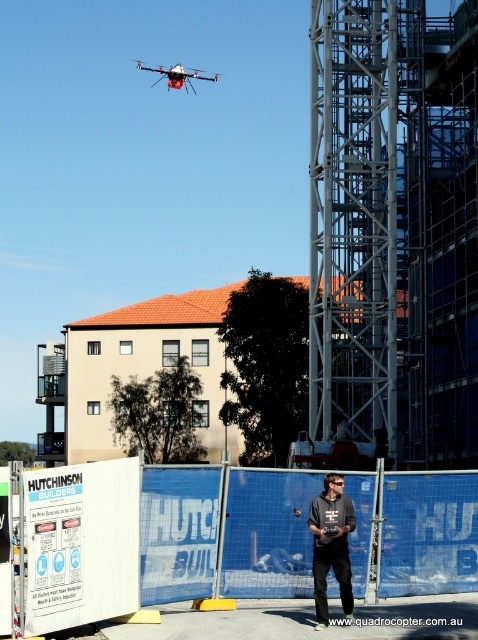
Can you confirm if dark gray shirt at center is taller than white matte drone at upper center?

No.

Which is in front, point (347, 580) or point (178, 61)?

Positioned in front is point (347, 580).

Describe the element at coordinates (330, 545) in the screenshot. I see `dark gray shirt at center` at that location.

This screenshot has width=478, height=640. What are the coordinates of `dark gray shirt at center` in the screenshot? It's located at (330, 545).